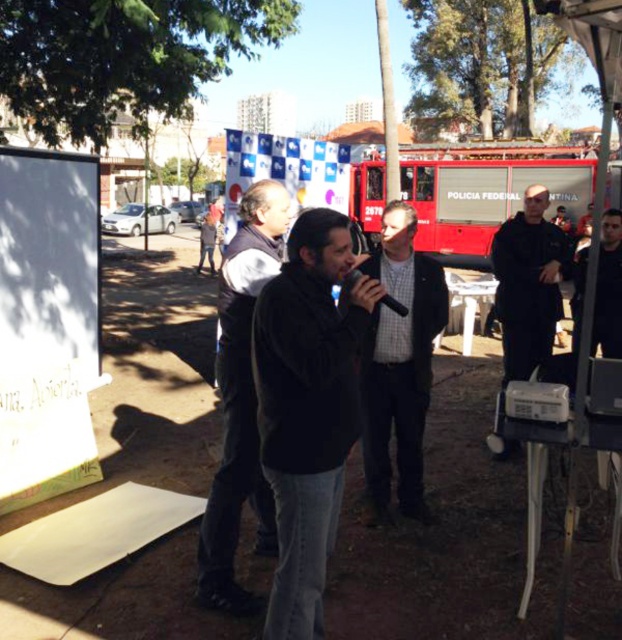
You are attending a public event and want to approach the speaker. You see a dark gray jacket at center and a dark blue uniform at center. Which one is closer to the left side of the scene?

The dark gray jacket at center is closer to the left side of the scene because it is positioned to the left of the dark blue uniform at center.

You are a photographer at the event and want to capture both the dark gray sweater at center and the dark gray jacket at center in the same photo. Which one should you focus on first to ensure both are in frame?

The dark gray sweater at center is positioned on the left side of dark gray jacket at center, so focus on the dark gray sweater at center first to ensure both are included in the photo.